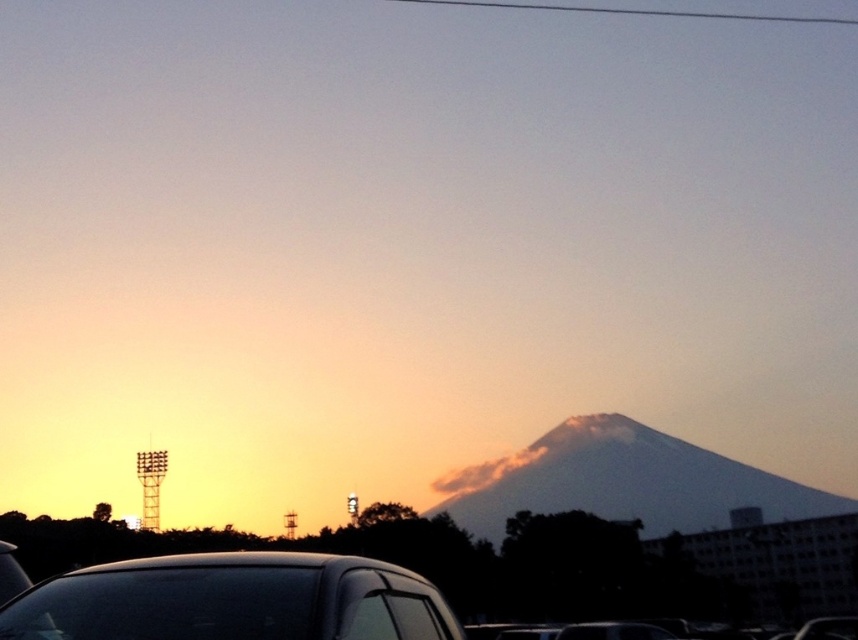
You are a photographer trying to capture the sunset with both the smokey gray mountain at center and the smokey white cloud at center in your shot. Based on their sizes, which one should you focus on to ensure they both fit in the frame?

The smokey gray mountain at center might be wider than the smokey white cloud at center, so focusing on the wider mountain would help ensure both fit in the frame.

You are a photographer planning to capture the sunset with both the smokey gray mountain at center and the smokey white cloud at center in the frame. Based on their sizes, which object should you focus on first to ensure they are both clearly visible in your photo?

The smokey gray mountain at center is much taller than the smokey white cloud at center, so you should focus on the smokey gray mountain at center first to ensure its details are captured clearly before adjusting for the smaller cloud.